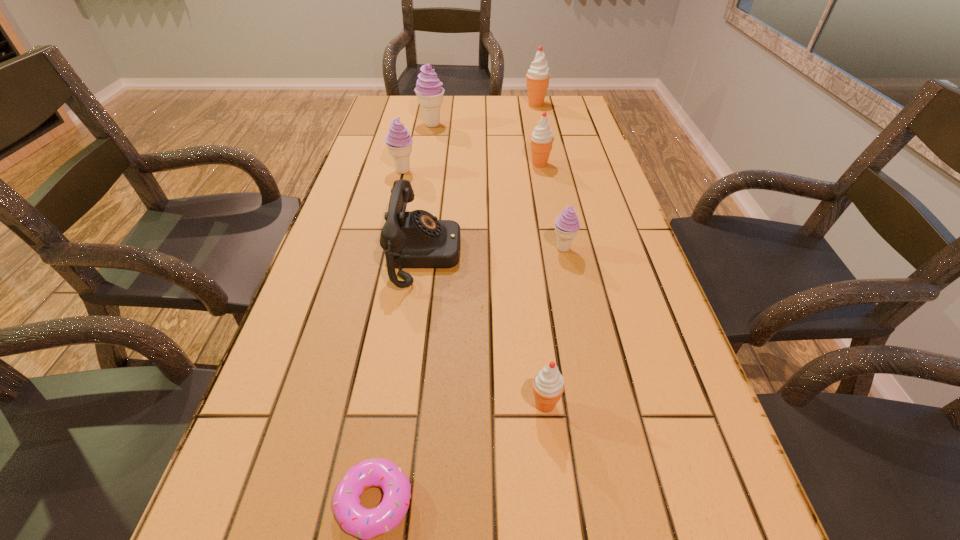
Locate an element on the screen. Image resolution: width=960 pixels, height=540 pixels. object identified as the second closest to the gray telephone is located at coordinates (566, 224).

This screenshot has height=540, width=960. In order to click on the sixth closest icecream to the gray telephone in this screenshot , I will do `click(538, 76)`.

Identify which icecream is located as the nearest to the second smallest purple icecream. Please provide its 2D coordinates. Your answer should be formatted as a tuple, i.e. [(x, y)], where the tuple contains the x and y coordinates of a point satisfying the conditions above.

[(428, 89)]

Image resolution: width=960 pixels, height=540 pixels. I want to click on the closest red icecream to the rightmost purple icecream, so click(542, 138).

This screenshot has height=540, width=960. In order to click on red icecream object that ranks as the closest to the second farthest object in this screenshot , I will do `click(538, 76)`.

Select which purple icecream is the closest to the nearest icecream. Please provide its 2D coordinates. Your answer should be formatted as a tuple, i.e. [(x, y)], where the tuple contains the x and y coordinates of a point satisfying the conditions above.

[(566, 224)]

Image resolution: width=960 pixels, height=540 pixels. I want to click on the closest purple icecream to the biggest purple icecream, so click(399, 142).

The image size is (960, 540). What are the coordinates of `blank area in the image that satisfies the following two spatial constraints: 1. on the front side of the biggest purple icecream; 2. on the right side of the nearest purple icecream` in the screenshot? It's located at (410, 248).

Identify the location of free space that satisfies the following two spatial constraints: 1. on the front side of the smallest red icecream; 2. on the right side of the second nearest purple icecream. (348, 404).